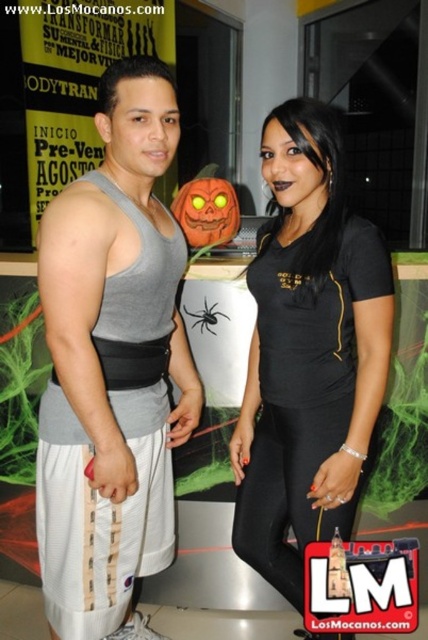
You are a photographer at the event and need to capture a clear shot of both the black matte shirt at center and the black matte spider at center. Since the spider is smaller, will you need to adjust your camera focus to ensure both are in focus?

The black matte shirt at center is taller than the black matte spider at center, so the shirt is larger. Since the spider is smaller, you may need to adjust your camera focus to ensure both are in focus.

You are standing at the entrance of the gym and want to approach the two people. You notice two points marked on the floor at coordinates point (151, 563) and point (207, 323). Which point should you walk towards if you want to reach the person closer to the entrance?

Point (151, 563) is in front of point (207, 323), so you should walk towards point (151, 563) to reach the person closer to the entrance.

You are a photographer at a fitness event. You need to take a photo of the gray fabric tank top at center and the black matte spider at center. Which object should you focus on first if you want to capture both in the same frame without moving the camera?

The gray fabric tank top at center is bigger than the black matte spider at center, so you should focus on the gray fabric tank top at center first to ensure it fills the frame appropriately before adjusting for the smaller black matte spider at center.